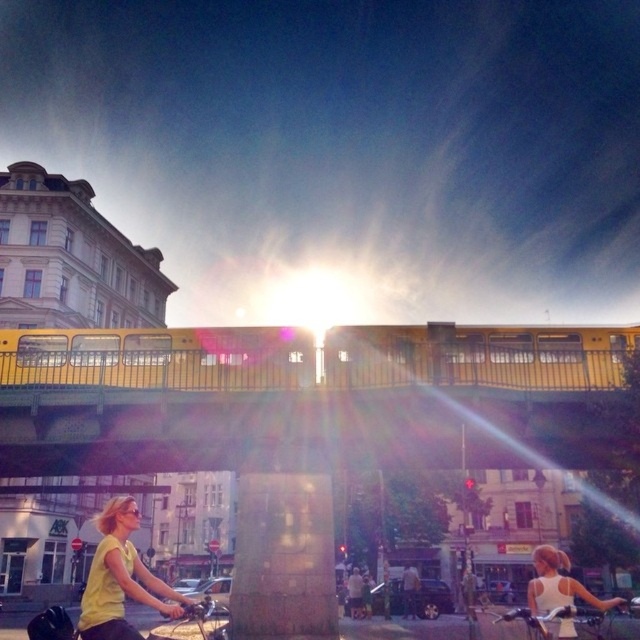
Question: Which object is positioned farthest from the matte yellow bicycle at lower left?

Choices:
 (A) satin gold pillar at center
 (B) white matte tank top at center
 (C) metallic silver bicycle at center
 (D) yellow matte shirt at lower left

Answer: (B)

Question: Can you confirm if satin gold pillar at center is thinner than yellow matte shirt at lower left?

Choices:
 (A) yes
 (B) no

Answer: (A)

Question: Is white matte tank top at center below metallic silver bicycle at center?

Choices:
 (A) no
 (B) yes

Answer: (A)

Question: Which point is farther to the camera?

Choices:
 (A) click(x=248, y=497)
 (B) click(x=522, y=618)

Answer: (A)

Question: Can you confirm if yellow matte shirt at lower left is wider than matte yellow bicycle at lower left?

Choices:
 (A) yes
 (B) no

Answer: (B)

Question: Which is nearer to the yellow matte shirt at lower left?

Choices:
 (A) matte yellow bicycle at lower left
 (B) metallic silver bicycle at center
 (C) white matte tank top at center

Answer: (A)